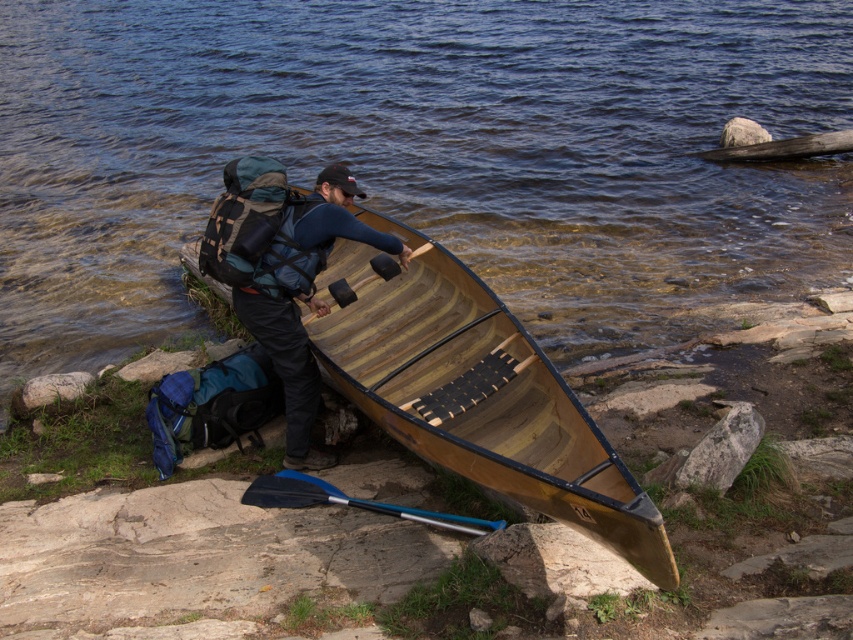
Does clear water at center appear on the left side of matte black backpack at center?

Indeed, clear water at center is positioned on the left side of matte black backpack at center.

Does clear water at center lie behind matte black backpack at center?

Yes, clear water at center is further from the viewer.

Who is more distant from viewer, (x=173, y=17) or (x=320, y=221)?

The point (x=173, y=17) is behind.

Where is `clear water at center`? clear water at center is located at coordinates (419, 154).

Which is below, wooden canoe at center or wooden paddle at center?

Positioned lower is wooden canoe at center.

Who is more distant from viewer, [589,476] or [375,264]?

The point [375,264] is behind.

In order to click on wooden canoe at center in this screenshot , I will do `click(485, 403)`.

Is matte black backpack at center closer to camera compared to wooden paddle at center?

Yes, matte black backpack at center is closer to the viewer.

Who is more forward, (296, 243) or (334, 292)?

Point (296, 243) is more forward.

Locate an element on the screen. The height and width of the screenshot is (640, 853). matte black backpack at center is located at coordinates (303, 298).